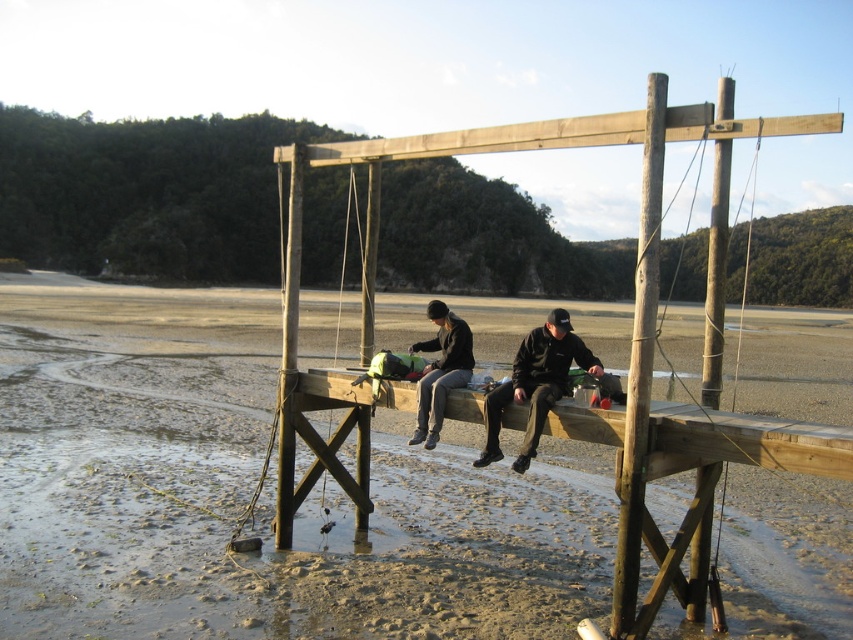
Which is above, wooden pier at center or black matte jacket at center?

wooden pier at center is above.

Can you confirm if wooden pier at center is positioned to the left of black matte jacket at center?

Indeed, wooden pier at center is positioned on the left side of black matte jacket at center.

Who is more forward, (773,509) or (601,372)?

Point (601,372)

You are a GUI agent. You are given a task and a screenshot of the screen. Output one action in this format:
    pyautogui.click(x=<x>, y=<y>)
    Task: Click on the wooden pier at center
    
    Given the screenshot: What is the action you would take?
    pyautogui.click(x=245, y=483)

Which is more to the left, smooth wooden pole at center or black matte jacket at center?

black matte jacket at center is more to the left.

Which is below, smooth wooden pole at center or black matte jacket at center?

black matte jacket at center is below.

Describe the element at coordinates (639, 364) in the screenshot. Image resolution: width=853 pixels, height=640 pixels. I see `smooth wooden pole at center` at that location.

This screenshot has height=640, width=853. Identify the location of smooth wooden pole at center. (639, 364).

Does wooden pier at center have a greater height compared to smooth wooden pole at center?

No.

Locate an element on the screen. The height and width of the screenshot is (640, 853). wooden pier at center is located at coordinates (245, 483).

Identify the location of wooden pier at center. (245, 483).